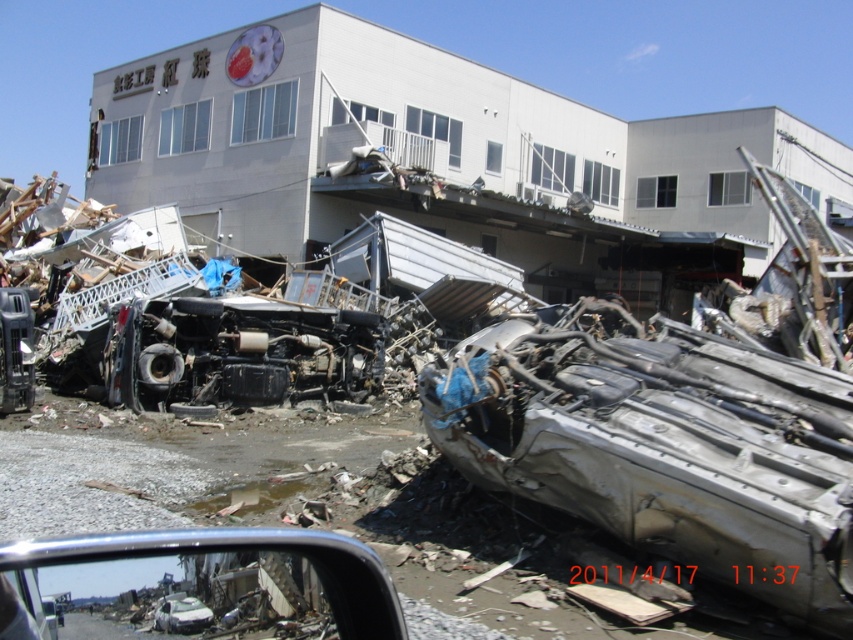
Which is above, rusty metallic car at center or silver metallic car at center?

Positioned higher is silver metallic car at center.

Which is below, rusty metallic car at center or silver metallic car at center?

Positioned lower is rusty metallic car at center.

Identify the location of rusty metallic car at center. The image size is (853, 640). (663, 445).